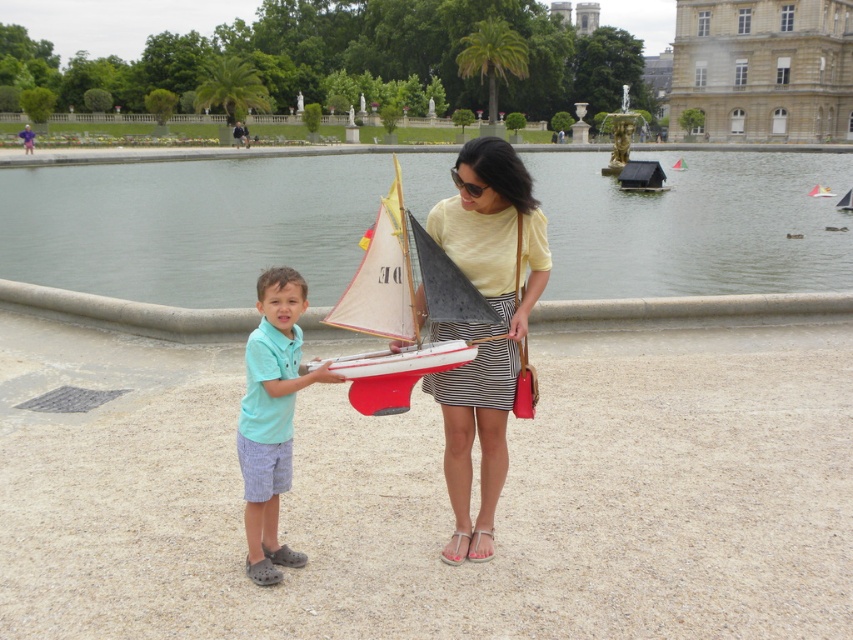
In the scene shown: You are standing at the camera position and want to pick up an object. Which point, point (752, 93) or point (412, 348), is closer to you?

Point (752, 93) is further to the camera than point (412, 348), so the closer point to you is point (412, 348).

You are standing at the center of the sandy path in the image. You want to walk towards the brown stone building at upper right. What direction should you walk in?

The brown stone building at upper right is located at coordinates (763, 68), so you should walk towards the upper right direction to reach it.